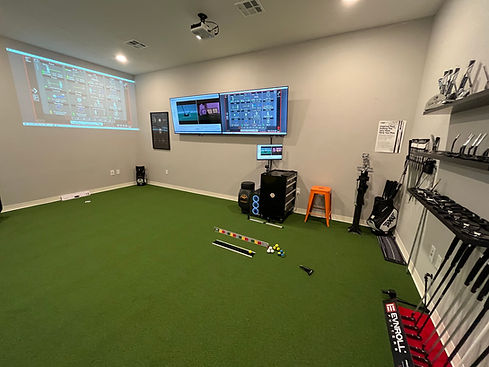
Where is `small monitor`? The image size is (489, 367). small monitor is located at coordinates (280, 151).